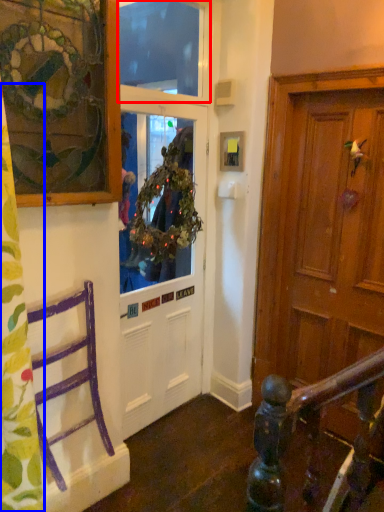
Question: Among these objects, which one is farthest to the camera, window screen (highlighted by a red box) or curtain (highlighted by a blue box)?

Choices:
 (A) window screen
 (B) curtain

Answer: (A)